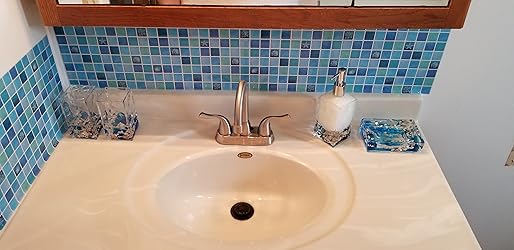
The width and height of the screenshot is (514, 250). I want to click on mirror, so click(230, 1).